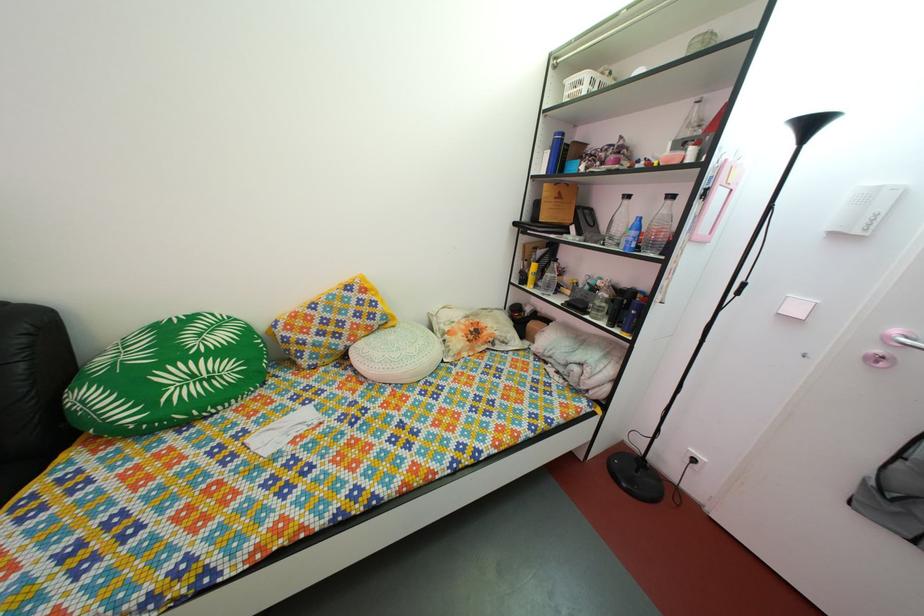
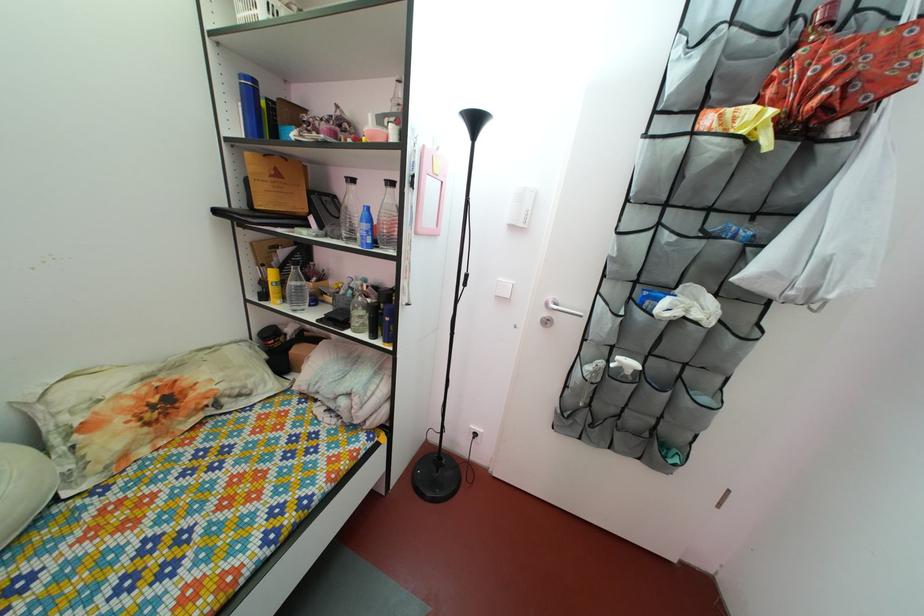
The point at (549, 261) is marked in the first image. Where is the corresponding point in the second image?

(292, 262)